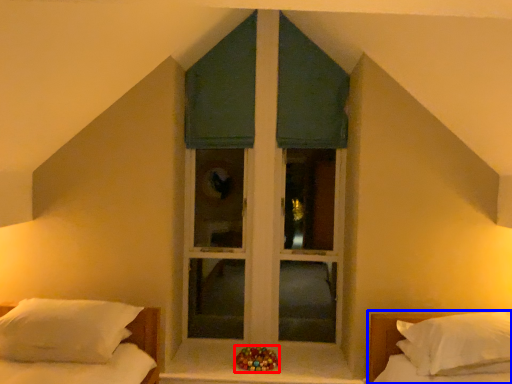
Question: Which of the following is the closest to the observer, miniature (highlighted by a red box) or bed (highlighted by a blue box)?

Choices:
 (A) miniature
 (B) bed

Answer: (B)